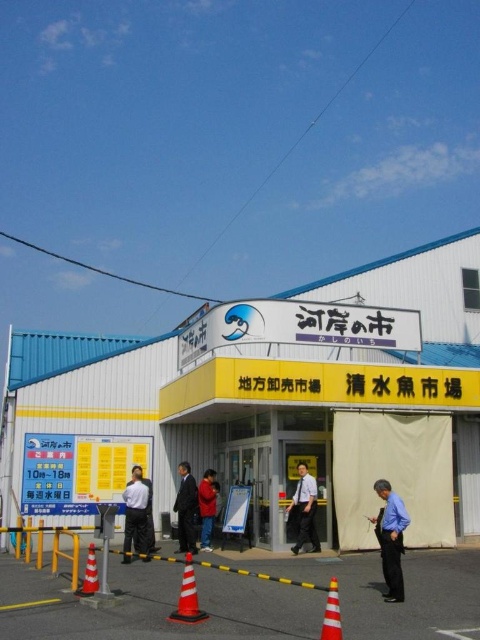
Describe the element at coordinates (391, 538) in the screenshot. The width and height of the screenshot is (480, 640). I see `blue shirt at lower center` at that location.

Who is more forward, (396, 557) or (204, 516)?

Positioned in front is point (396, 557).

Does point (408, 522) come farther from viewer compared to point (205, 504)?

No.

Image resolution: width=480 pixels, height=640 pixels. What are the coordinates of `blue shirt at lower center` in the screenshot? It's located at (391, 538).

Which is more to the left, white matte building at center or dark gray suit at center?

dark gray suit at center

Does white matte building at center have a lesser width compared to dark gray suit at center?

No.

Is point (478, 298) closer to camera compared to point (137, 467)?

No, (478, 298) is behind (137, 467).

The image size is (480, 640). I want to click on white matte building at center, so click(x=271, y=403).

Is orange reflective cone at lower center closer to the viewer compared to orange plastic traffic cone at center?

Yes, orange reflective cone at lower center is in front of orange plastic traffic cone at center.

Which is behind, point (322, 637) or point (92, 573)?

Point (92, 573)

The image size is (480, 640). In order to click on orange reflective cone at lower center in this screenshot , I will do `click(332, 612)`.